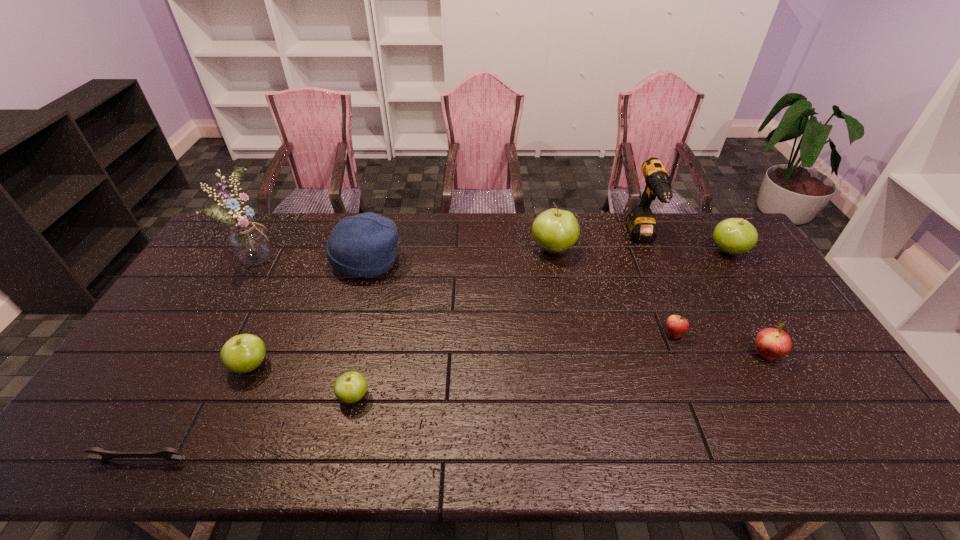
Where is `unoccupied area between the third green apple from right to left and the leftmost green apple`? The width and height of the screenshot is (960, 540). unoccupied area between the third green apple from right to left and the leftmost green apple is located at coordinates (302, 381).

Locate an element on the screen. the eighth closest object to the leftmost green apple is located at coordinates (771, 343).

Choose which object is the seventh nearest neighbor to the leftmost apple. Please provide its 2D coordinates. Your answer should be formatted as a tuple, i.e. [(x, y)], where the tuple contains the x and y coordinates of a point satisfying the conditions above.

[(641, 225)]

Identify the location of apple that is the second closest one to the second apple from left to right. (554, 230).

Select which apple is the third closest to the smallest green apple. Please provide its 2D coordinates. Your answer should be formatted as a tuple, i.e. [(x, y)], where the tuple contains the x and y coordinates of a point satisfying the conditions above.

[(676, 325)]

Locate which green apple ranks in proximity to the shortest object. Please provide its 2D coordinates. Your answer should be formatted as a tuple, i.e. [(x, y)], where the tuple contains the x and y coordinates of a point satisfying the conditions above.

[(243, 353)]

Where is `green apple that is the third closest to the fourth nearest apple`? This screenshot has width=960, height=540. green apple that is the third closest to the fourth nearest apple is located at coordinates (350, 387).

What are the coordinates of `blank space that satisfies the following two spatial constraints: 1. on the front side of the fifth shortest apple; 2. on the front-facing side of the tallest object` in the screenshot? It's located at (731, 256).

Locate an element on the screen. This screenshot has height=540, width=960. free space that satisfies the following two spatial constraints: 1. on the front-facing side of the tallest object; 2. on the open ends of the wrench is located at coordinates (145, 460).

The image size is (960, 540). Find the location of `free location that satisfies the following two spatial constraints: 1. at the tip of the right red apple; 2. on the right side of the drill`. free location that satisfies the following two spatial constraints: 1. at the tip of the right red apple; 2. on the right side of the drill is located at coordinates (692, 355).